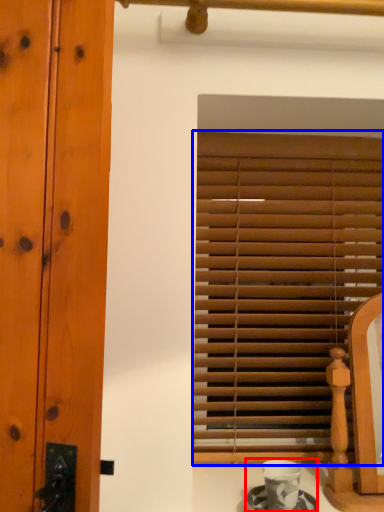
Question: Among these objects, which one is farthest to the camera, tea set (highlighted by a red box) or window blind (highlighted by a blue box)?

Choices:
 (A) tea set
 (B) window blind

Answer: (B)